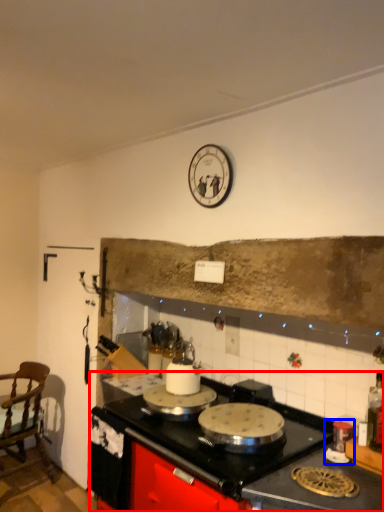
Question: Which object appears closest to the camera in this image, countertop (highlighted by a red box) or appliance (highlighted by a blue box)?

Choices:
 (A) countertop
 (B) appliance

Answer: (A)